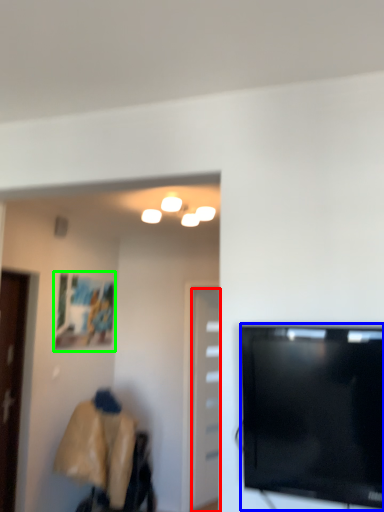
Question: Which is nearer to the door (highlighted by a red box)? television (highlighted by a blue box) or picture frame (highlighted by a green box).

Choices:
 (A) television
 (B) picture frame

Answer: (B)